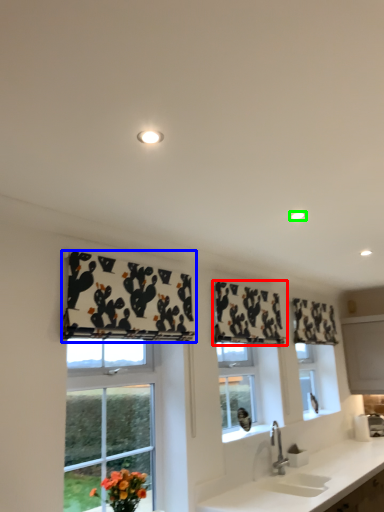
Question: Which object is the farthest from curtain (highlighted by a red box)? Choose among these: curtain (highlighted by a blue box) or lighting (highlighted by a green box).

Choices:
 (A) curtain
 (B) lighting

Answer: (B)